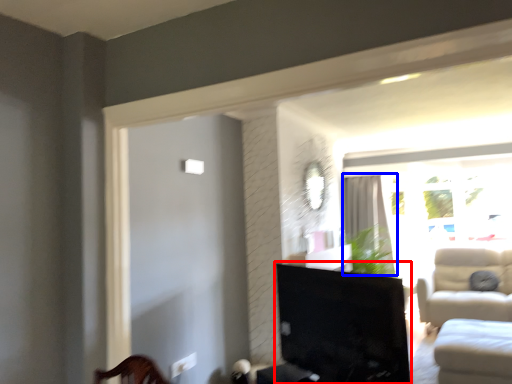
Question: Among these objects, which one is nearest to the camera, furniture (highlighted by a red box) or curtain (highlighted by a blue box)?

Choices:
 (A) furniture
 (B) curtain

Answer: (A)